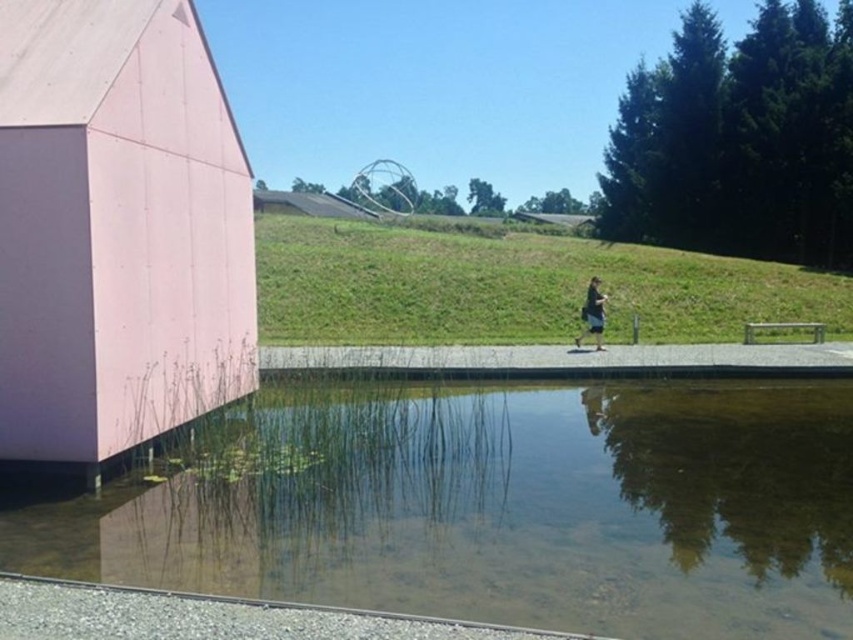
You are standing in the outdoor scene and want to take a photo of the matte pink wall at left without including the clear glass water at lower center. Which direction should you move to achieve this?

You should move to the right. Since the clear glass water at lower center is closer to the viewer than the matte pink wall at left, moving to the right would allow you to position yourself away from the water and frame the wall without it obstructing the view.

You are a landscape architect designing a pathway between the clear glass water at lower center and the matte pink wall at left. Given their spatial relationship, which object should the pathway be closer to?

The pathway should be closer to the matte pink wall at left because the clear glass water at lower center is wider, so placing the pathway near the narrower matte pink wall at left would optimize space usage.

You are standing in the outdoor scene and want to locate the matte pink wall at left. According to the coordinates provided, where would you look to find it?

The matte pink wall at left is located at point coordinates (x=115, y=230).